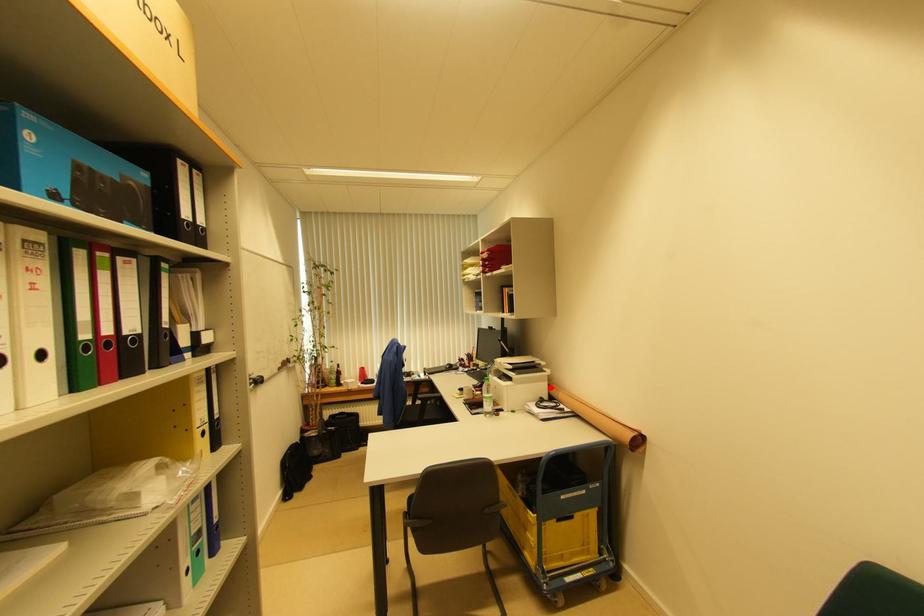
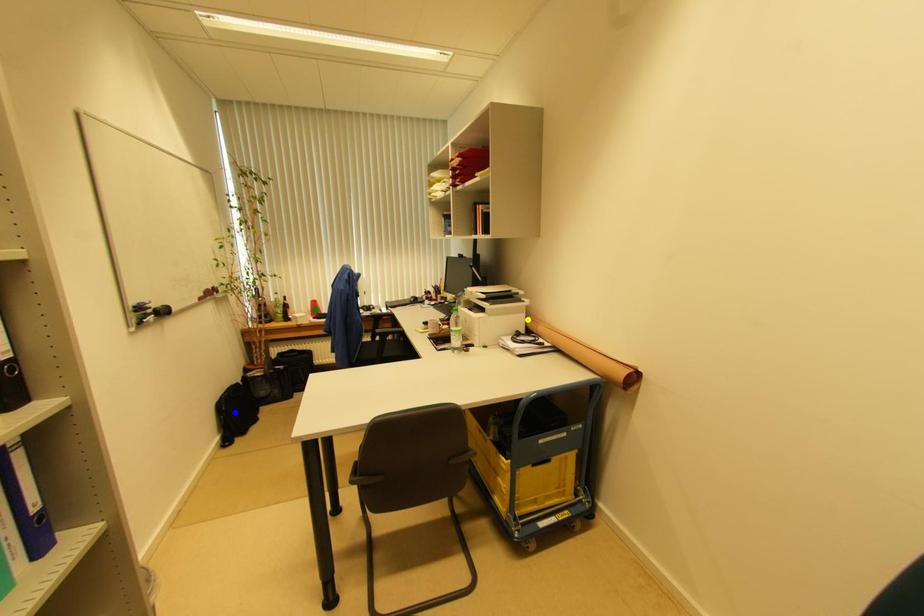
Question: I am providing you with two images of the same scene from different viewpoints. A red point is marked on the first image. You are given multiple points on the second image. Which mark in image 2 goes with the point in image 1?

Choices:
 (A) blue point
 (B) yellow point
 (C) green point

Answer: (B)